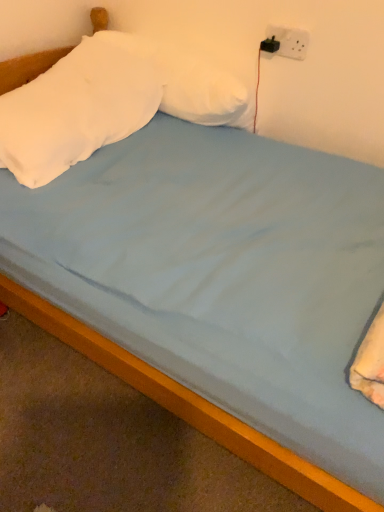
Question: Considering the positions of white plastic socket at upper right and white soft pillow at upper center, acting as the 1th pillow starting from the right, in the image, is white plastic socket at upper right bigger or smaller than white soft pillow at upper center, acting as the 1th pillow starting from the right,?

Choices:
 (A) big
 (B) small

Answer: (B)

Question: In terms of width, does white plastic socket at upper right look wider or thinner when compared to white soft pillow at upper center, acting as the 1th pillow starting from the right?

Choices:
 (A) thin
 (B) wide

Answer: (A)

Question: Which object is positioned closest to the wooden bed frame at lower center?

Choices:
 (A) white soft pillow at upper left, the 1th pillow when ordered from left to right
 (B) white soft pillow at upper center, the 2th pillow positioned from the left
 (C) white plastic socket at upper right

Answer: (A)

Question: Based on their relative distances, which object is nearer to the white soft pillow at upper center, acting as the 1th pillow starting from the right?

Choices:
 (A) white soft pillow at upper left, which is the 2th pillow from right to left
 (B) wooden bed frame at lower center
 (C) white plastic socket at upper right

Answer: (A)